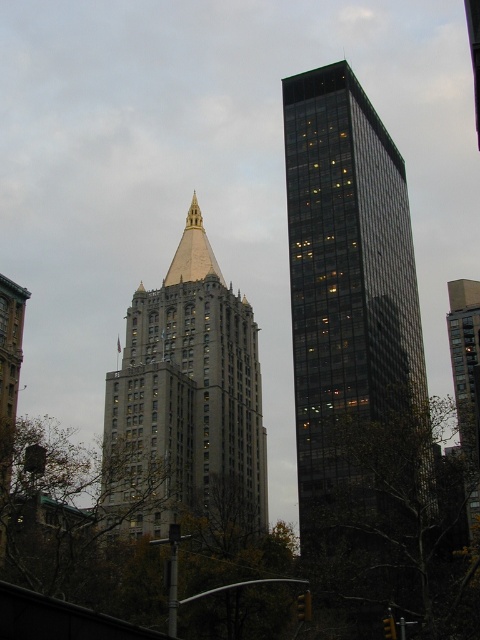
Question: Which object is farther from the camera taking this photo?

Choices:
 (A) dark glass skyscraper at right
 (B) gold/brass spire at center
 (C) gray stone building at center

Answer: (B)

Question: Estimate the real-world distances between objects in this image. Which object is closer to the dark glass skyscraper at right?

Choices:
 (A) gold/brass spire at center
 (B) gray stone building at center

Answer: (B)

Question: Is dark glass skyscraper at right bigger than gray stone building at center?

Choices:
 (A) no
 (B) yes

Answer: (A)

Question: Which is farther from the dark glass skyscraper at right?

Choices:
 (A) gold/brass spire at center
 (B) gray stone building at center

Answer: (A)

Question: Does gray stone building at center lie in front of gold/brass spire at center?

Choices:
 (A) yes
 (B) no

Answer: (A)

Question: Is dark glass skyscraper at right behind gray stone building at center?

Choices:
 (A) no
 (B) yes

Answer: (A)